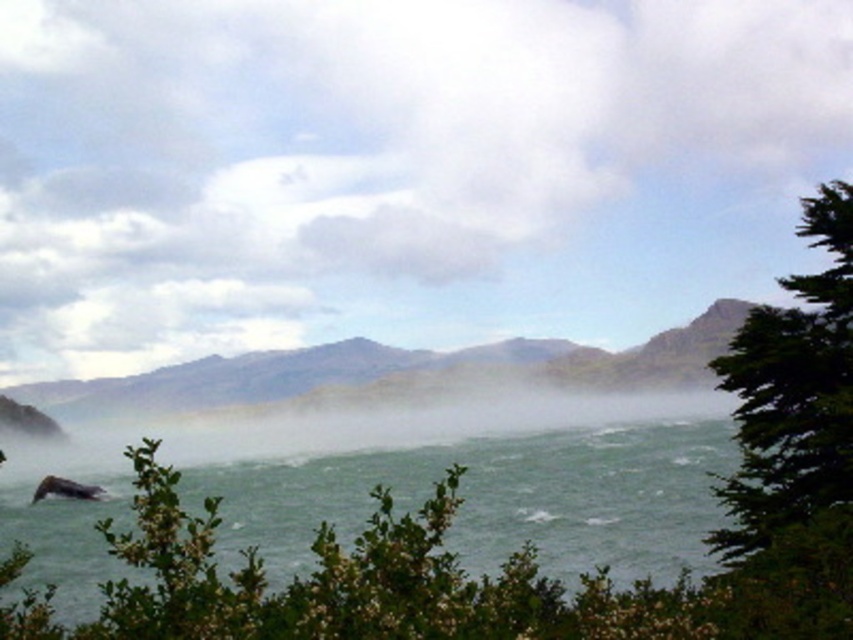
Measure the distance between green rough water at lower left and rugged rock mountain at center.

green rough water at lower left is 244.34 feet from rugged rock mountain at center.

Which is more to the right, green rough water at lower left or rugged rock mountain at center?

Positioned to the right is green rough water at lower left.

Which is behind, point (697, 522) or point (345, 397)?

The point (345, 397) is more distant.

The height and width of the screenshot is (640, 853). Identify the location of green rough water at lower left. (390, 493).

Can you confirm if rugged rock mountain at center is taller than green leafy tree at right?

Indeed, rugged rock mountain at center has a greater height compared to green leafy tree at right.

Between point (527, 368) and point (796, 316), which one is positioned in front?

Point (796, 316) is more forward.

Where is `rugged rock mountain at center`? rugged rock mountain at center is located at coordinates (393, 371).

Which of these two, green rough water at lower left or green leafy tree at right, stands shorter?

green leafy tree at right

Which is more to the right, green rough water at lower left or green leafy tree at right?

Positioned to the right is green leafy tree at right.

Who is more forward, (x=520, y=483) or (x=845, y=422)?

Point (x=845, y=422)

You are a GUI agent. You are given a task and a screenshot of the screen. Output one action in this format:
    pyautogui.click(x=<x>, y=<y>)
    Task: Click on the green rough water at lower left
    
    Given the screenshot: What is the action you would take?
    pyautogui.click(x=390, y=493)